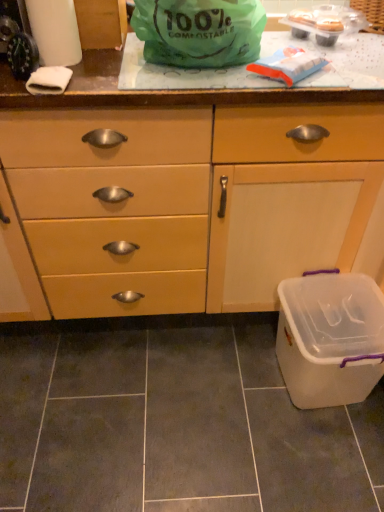
Question: Can you confirm if matte wood cabinet at center is positioned to the right of white plastic container at lower right?

Choices:
 (A) yes
 (B) no

Answer: (B)

Question: Is matte wood cabinet at center far from white plastic container at lower right?

Choices:
 (A) no
 (B) yes

Answer: (A)

Question: From the image's perspective, is matte wood cabinet at center located above white plastic container at lower right?

Choices:
 (A) no
 (B) yes

Answer: (B)

Question: From the image's perspective, is matte wood cabinet at center under white plastic container at lower right?

Choices:
 (A) no
 (B) yes

Answer: (A)

Question: Is matte wood cabinet at center next to white plastic container at lower right and touching it?

Choices:
 (A) yes
 (B) no

Answer: (B)

Question: Does matte wood cabinet at center have a smaller size compared to white plastic container at lower right?

Choices:
 (A) no
 (B) yes

Answer: (A)

Question: Can you confirm if green compostable bag at upper center is shorter than white plastic container at lower right?

Choices:
 (A) no
 (B) yes

Answer: (B)

Question: Is green compostable bag at upper center turned away from white plastic container at lower right?

Choices:
 (A) no
 (B) yes

Answer: (A)

Question: Does green compostable bag at upper center appear on the left side of white plastic container at lower right?

Choices:
 (A) no
 (B) yes

Answer: (B)

Question: Is green compostable bag at upper center surrounding white plastic container at lower right?

Choices:
 (A) yes
 (B) no

Answer: (B)

Question: Does green compostable bag at upper center have a lesser width compared to white plastic container at lower right?

Choices:
 (A) no
 (B) yes

Answer: (B)

Question: Is green compostable bag at upper center smaller than white plastic container at lower right?

Choices:
 (A) yes
 (B) no

Answer: (A)

Question: From the image's perspective, is white paper towel at upper left on top of white plastic container at lower right?

Choices:
 (A) yes
 (B) no

Answer: (A)